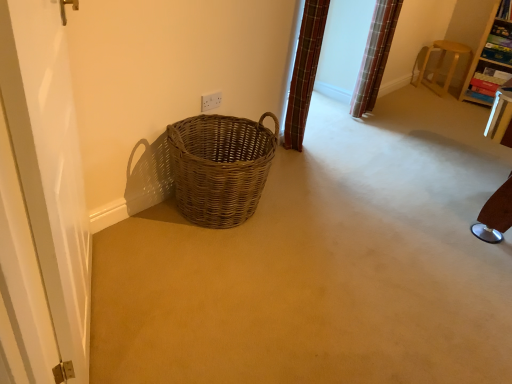
Find the location of `free point to the right of plaid fabric curtain at upper right, which is counted as the 1th curtain, starting from the front`. free point to the right of plaid fabric curtain at upper right, which is counted as the 1th curtain, starting from the front is located at coordinates (323, 145).